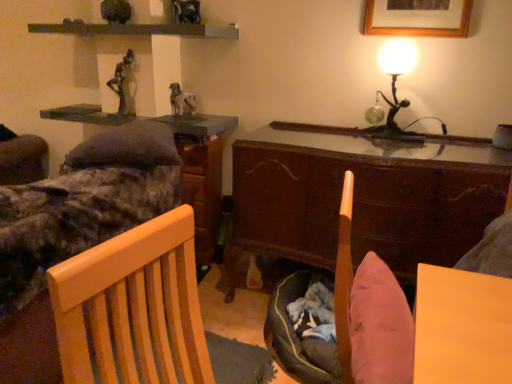
Question: Does metallic gold table lamp at upper right come behind wooden cabinet at center?

Choices:
 (A) no
 (B) yes

Answer: (B)

Question: Considering the relative sizes of metallic gold table lamp at upper right and wooden cabinet at center in the image provided, is metallic gold table lamp at upper right bigger than wooden cabinet at center?

Choices:
 (A) no
 (B) yes

Answer: (A)

Question: Is metallic gold table lamp at upper right completely or partially outside of wooden cabinet at center?

Choices:
 (A) yes
 (B) no

Answer: (A)

Question: Is metallic gold table lamp at upper right aimed at wooden cabinet at center?

Choices:
 (A) yes
 (B) no

Answer: (B)

Question: Is metallic gold table lamp at upper right turned away from wooden cabinet at center?

Choices:
 (A) yes
 (B) no

Answer: (B)

Question: Can you confirm if metallic gold table lamp at upper right is shorter than wooden cabinet at center?

Choices:
 (A) no
 (B) yes

Answer: (B)

Question: Considering the relative sizes of wooden cabinet at center and wooden bed frame at left in the image provided, is wooden cabinet at center thinner than wooden bed frame at left?

Choices:
 (A) yes
 (B) no

Answer: (A)

Question: From a real-world perspective, is wooden cabinet at center located beneath wooden bed frame at left?

Choices:
 (A) no
 (B) yes

Answer: (A)

Question: Does wooden cabinet at center touch wooden bed frame at left?

Choices:
 (A) no
 (B) yes

Answer: (A)

Question: Can you confirm if wooden cabinet at center is shorter than wooden bed frame at left?

Choices:
 (A) yes
 (B) no

Answer: (A)

Question: From a real-world perspective, is wooden cabinet at center on wooden bed frame at left?

Choices:
 (A) yes
 (B) no

Answer: (A)

Question: Is wooden cabinet at center looking in the opposite direction of wooden bed frame at left?

Choices:
 (A) no
 (B) yes

Answer: (A)

Question: Is bronze statue at upper center positioned in front of wooden file cabinet at center?

Choices:
 (A) yes
 (B) no

Answer: (A)